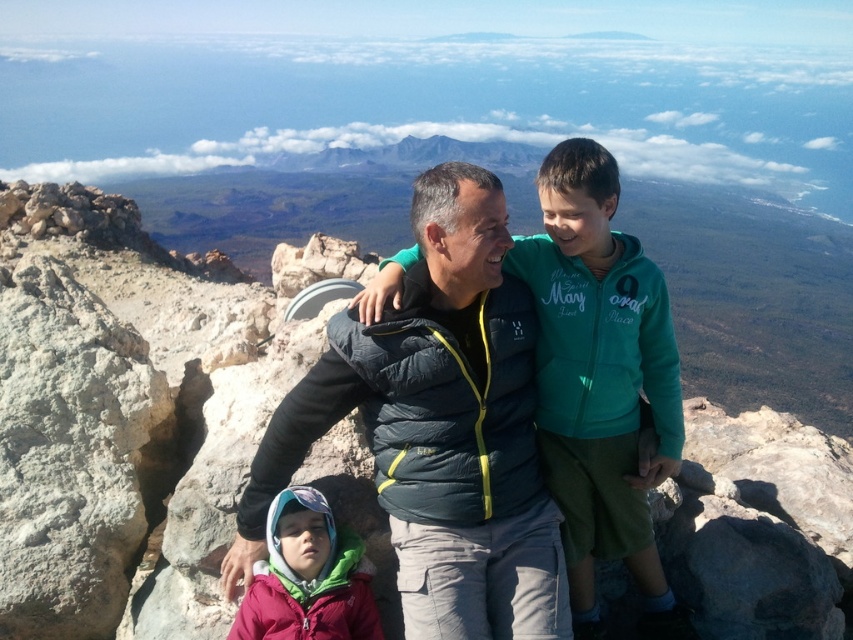
Is point (621, 436) farther from viewer compared to point (312, 625)?

Yes, point (621, 436) is behind point (312, 625).

Is teal fleece jacket at center in front of matte pink jacket at lower left?

No, teal fleece jacket at center is behind matte pink jacket at lower left.

Does point (610, 538) come farther from viewer compared to point (372, 637)?

Yes.

You are a GUI agent. You are given a task and a screenshot of the screen. Output one action in this format:
    pyautogui.click(x=<x>, y=<y>)
    Task: Click on the teal fleece jacket at center
    Image resolution: width=853 pixels, height=640 pixels.
    Given the screenshot: What is the action you would take?
    pyautogui.click(x=601, y=381)

Which is below, dark blue down jacket at center or matte pink jacket at lower left?

Positioned lower is matte pink jacket at lower left.

Who is positioned more to the left, dark blue down jacket at center or matte pink jacket at lower left?

From the viewer's perspective, matte pink jacket at lower left appears more on the left side.

Which is in front, point (527, 317) or point (280, 540)?

Positioned in front is point (280, 540).

Locate an element on the screen. The image size is (853, 640). dark blue down jacket at center is located at coordinates (438, 428).

Can you confirm if dark blue down jacket at center is positioned to the right of teal fleece jacket at center?

In fact, dark blue down jacket at center is to the left of teal fleece jacket at center.

Does point (238, 548) come behind point (540, 406)?

No.

Where is `dark blue down jacket at center`? Image resolution: width=853 pixels, height=640 pixels. dark blue down jacket at center is located at coordinates (438, 428).